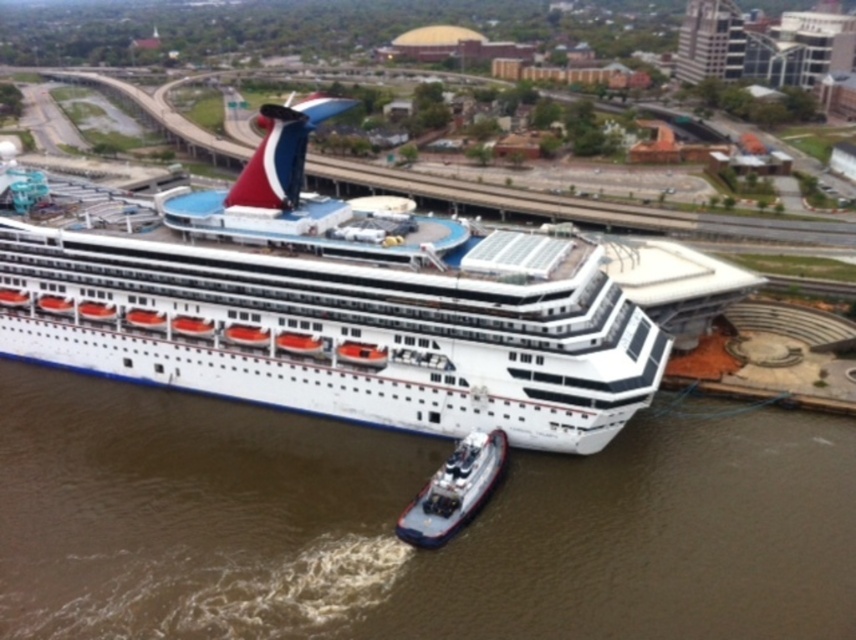
How distant is white glossy cruise ship at center from metallic gray tugboat at lower center?

They are 78.75 feet apart.

Which is in front, point (423, 381) or point (483, 460)?

Point (483, 460)

Between point (486, 404) and point (429, 540), which one is positioned behind?

Positioned behind is point (486, 404).

I want to click on white glossy cruise ship at center, so click(x=328, y=307).